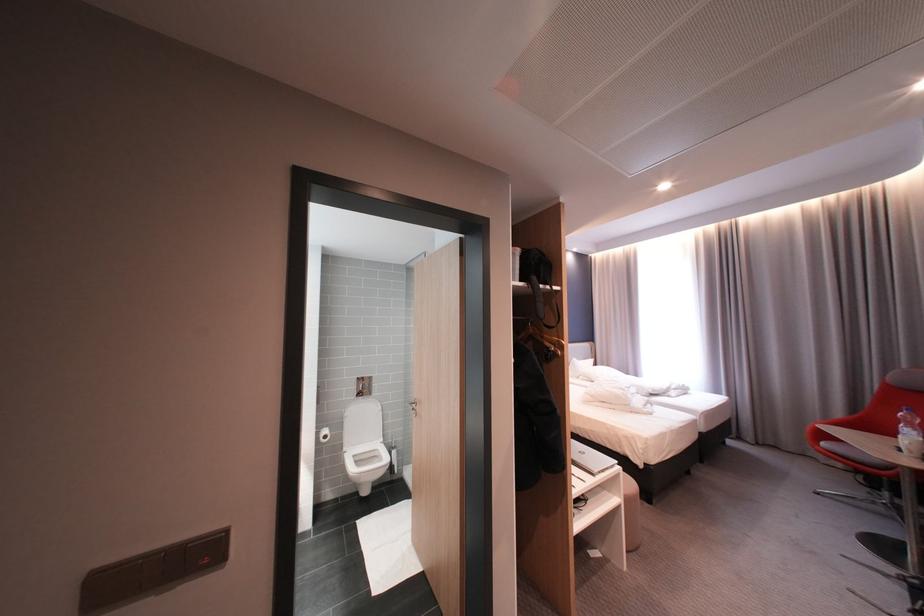
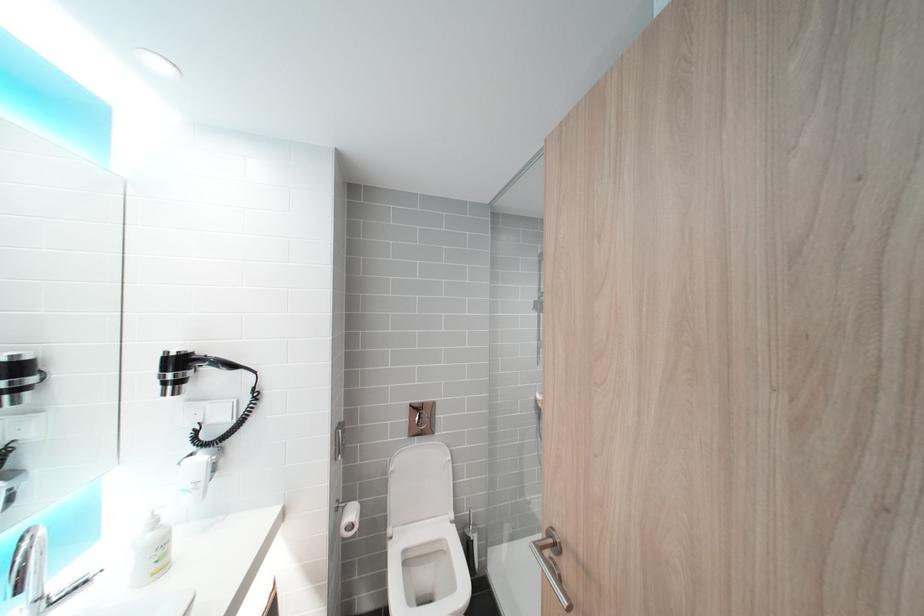
What movement of the cameraman would produce the second image?

The cameraman walked toward left, forward.